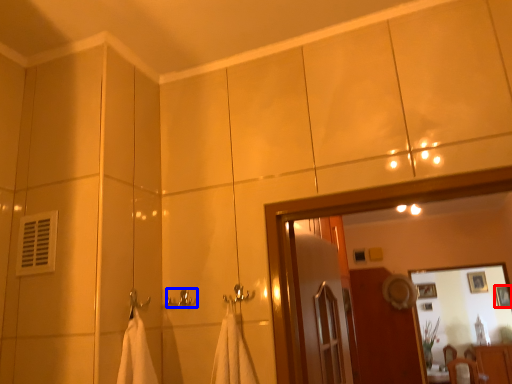
Question: Which of the following is the farthest to the observer, picture frame (highlighted by a red box) or towel bar (highlighted by a blue box)?

Choices:
 (A) picture frame
 (B) towel bar

Answer: (A)